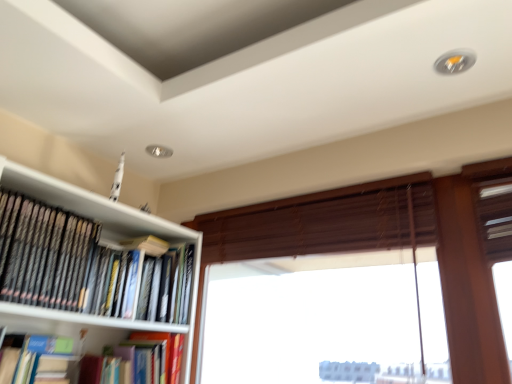
Question: Is black matte bookshelf at upper left, marked as the third book in a bottom-to-top arrangement, wider than brown wooden blind at center?

Choices:
 (A) yes
 (B) no

Answer: (B)

Question: Does black matte bookshelf at upper left, which is the 1th book in top-to-bottom order, have a greater height compared to brown wooden blind at center?

Choices:
 (A) yes
 (B) no

Answer: (A)

Question: Is brown wooden blind at center at the back of black matte bookshelf at upper left, which is the 1th book in top-to-bottom order?

Choices:
 (A) yes
 (B) no

Answer: (B)

Question: Is black matte bookshelf at upper left, which is the 1th book in top-to-bottom order, further to the viewer compared to brown wooden blind at center?

Choices:
 (A) yes
 (B) no

Answer: (B)

Question: Can you confirm if black matte bookshelf at upper left, marked as the third book in a bottom-to-top arrangement, is bigger than brown wooden blind at center?

Choices:
 (A) no
 (B) yes

Answer: (A)

Question: From the image's perspective, is brown wooden blind at center located above or below blue matte book at lower left, marked as the 2th book in a bottom-to-top arrangement?

Choices:
 (A) above
 (B) below

Answer: (A)

Question: Is brown wooden blind at center spatially inside blue matte book at lower left, the second book from the top, or outside of it?

Choices:
 (A) inside
 (B) outside

Answer: (B)

Question: From a real-world perspective, relative to blue matte book at lower left, marked as the 2th book in a bottom-to-top arrangement, is brown wooden blind at center vertically above or below?

Choices:
 (A) above
 (B) below

Answer: (A)

Question: Is point (326, 221) positioned closer to the camera than point (34, 360)?

Choices:
 (A) closer
 (B) farther

Answer: (B)

Question: From the image's perspective, is black matte bookshelf at upper left, marked as the third book in a bottom-to-top arrangement, positioned above or below blue matte book at lower left, marked as the 2th book in a bottom-to-top arrangement?

Choices:
 (A) above
 (B) below

Answer: (A)

Question: Considering the relative positions of black matte bookshelf at upper left, which is the 1th book in top-to-bottom order, and blue matte book at lower left, marked as the 2th book in a bottom-to-top arrangement, in the image provided, is black matte bookshelf at upper left, which is the 1th book in top-to-bottom order, to the left or to the right of blue matte book at lower left, marked as the 2th book in a bottom-to-top arrangement,?

Choices:
 (A) right
 (B) left

Answer: (A)

Question: Is black matte bookshelf at upper left, marked as the third book in a bottom-to-top arrangement, taller or shorter than blue matte book at lower left, the second book from the top?

Choices:
 (A) tall
 (B) short

Answer: (A)

Question: Considering their positions, is black matte bookshelf at upper left, which is the 1th book in top-to-bottom order, located in front of or behind blue matte book at lower left, marked as the 2th book in a bottom-to-top arrangement?

Choices:
 (A) front
 (B) behind

Answer: (A)

Question: Is black matte bookshelf at upper left, which is the 1th book in top-to-bottom order, taller or shorter than hardcover book at center, which ranks as the first book in bottom-to-top order?

Choices:
 (A) short
 (B) tall

Answer: (B)

Question: Is point (134, 286) closer or farther from the camera than point (97, 367)?

Choices:
 (A) closer
 (B) farther

Answer: (A)